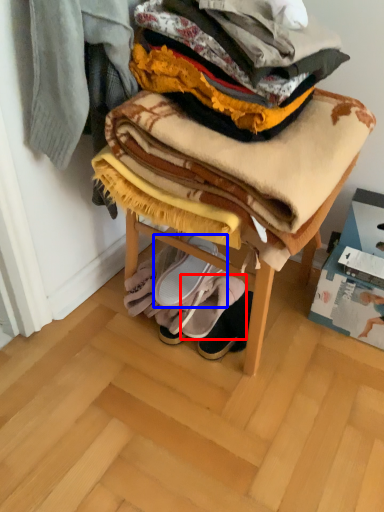
Question: Which object appears farthest to the camera in this image, footwear (highlighted by a red box) or footwear (highlighted by a blue box)?

Choices:
 (A) footwear
 (B) footwear

Answer: (B)